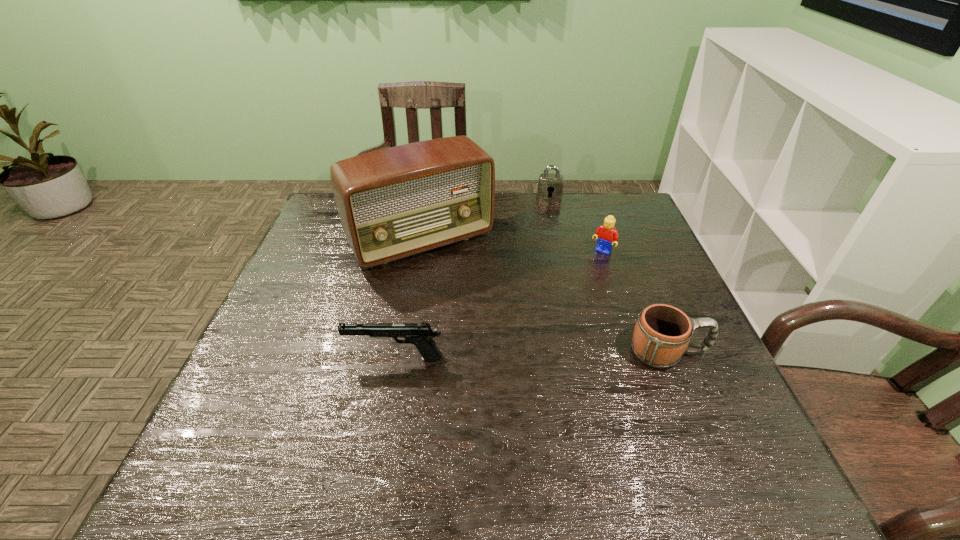
I want to click on vacant space on the desktop that is between the gun and the mug and is positioned on the front-facing side of the radio receiver, so click(x=500, y=356).

You are a GUI agent. You are given a task and a screenshot of the screen. Output one action in this format:
    pyautogui.click(x=<x>, y=<y>)
    Task: Click on the vacant spot on the desktop that is between the gun and the mug and is positioned on the front-facing side of the Lego
    The image size is (960, 540).
    Given the screenshot: What is the action you would take?
    pyautogui.click(x=524, y=355)

Locate an element on the screen. The height and width of the screenshot is (540, 960). free space on the desktop that is between the gun and the mug and is positioned at the front of the third object from left to right near the keyhole is located at coordinates (555, 355).